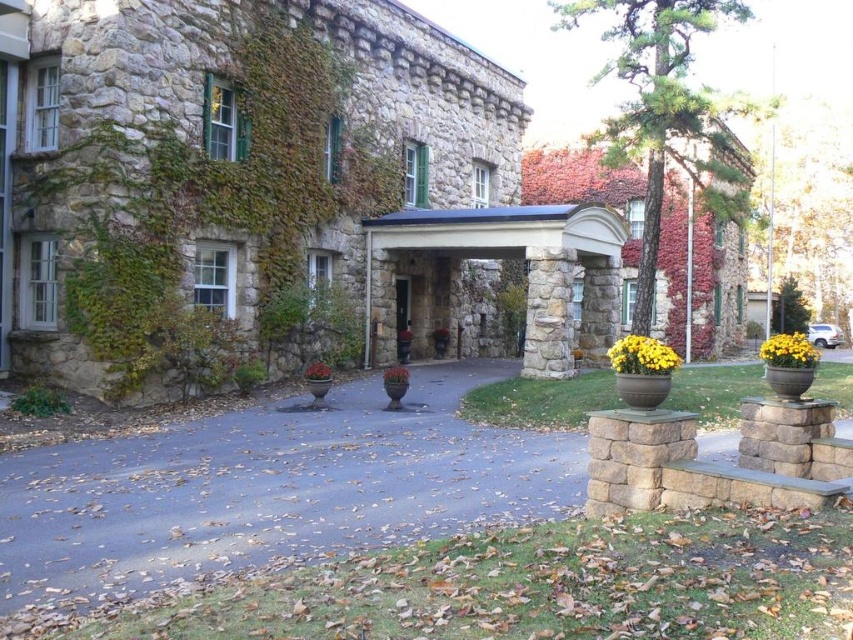
You are standing in front of the stone building and notice two planters at the center. The green matte planter at center and the matte ceramic pot at center. Which one is positioned higher?

The green matte planter at center is located above the matte ceramic pot at center, so the green matte planter at center is positioned higher.

You are standing at the entrance of the stone building and want to walk towards the point marked as point (312,364). However, there is an obstacle at point (804,346). Which point should you avoid to reach your destination safely?

You should avoid point (804,346) because it is in front of point (312,364), meaning it lies directly on the path towards your destination.